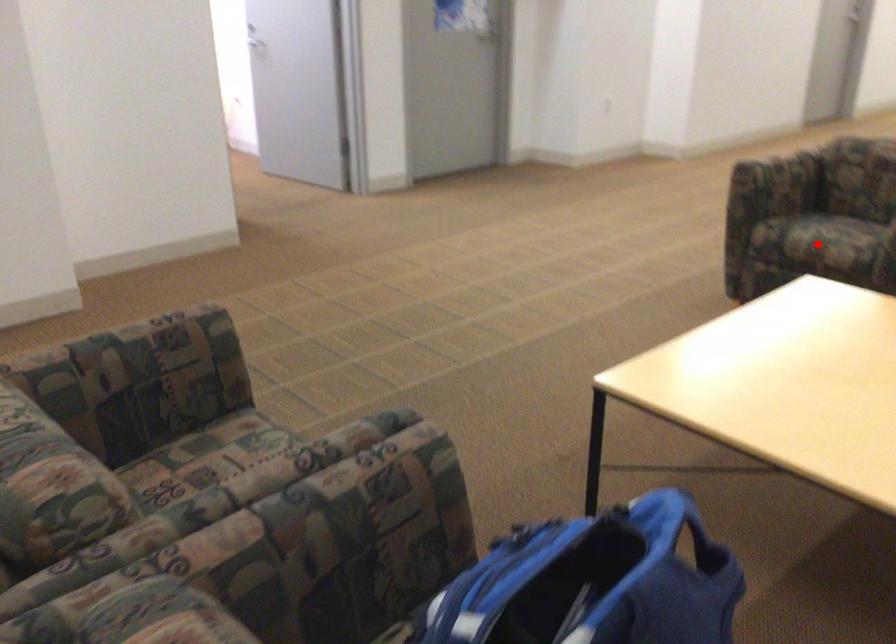
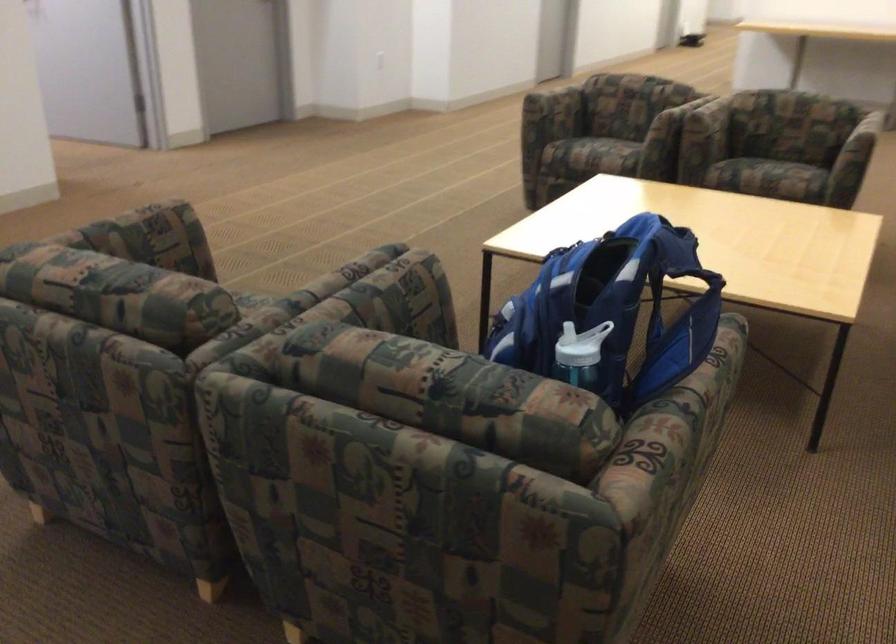
Question: I am providing you with two images of the same scene from different viewpoints. Image1 has a red point marked. In image2, the corresponding 3D location appears at what relative position? Reply with the corresponding letter.

Choices:
 (A) Closer
 (B) Farther

Answer: (B)